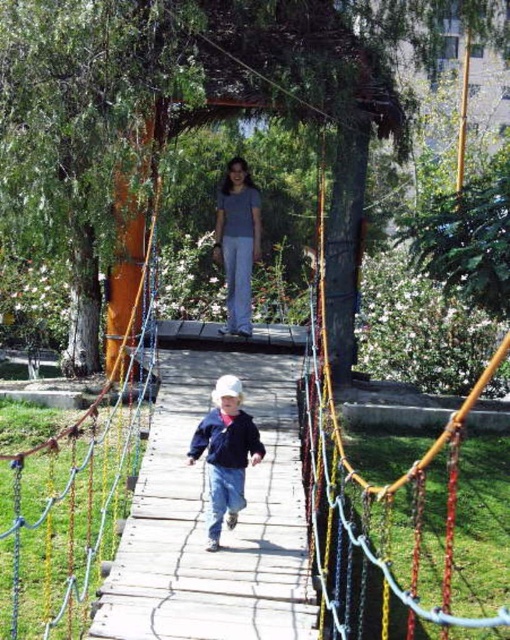
You are designing a safety plan for the suspension bridge and need to ensure that both the denim jacket at center and the matte gray shirt at center can walk side by side without touching each other. What is the minimum width the bridge must have?

The denim jacket at center has a larger width than the matte gray shirt at center. To ensure they can walk side by side without touching, the bridge must be at least the sum of both their widths plus a safe distance between them. However, since the exact widths aren not provided, the minimum width should be determined based on the widest individual, the denim jacket at center, plus a comfortable space for the other person.

You are standing on the wooden suspension bridge and want to reach the point at coordinates point [210,525]. If your walking speed is 3 feet per second, how many seconds will it take you to reach that point?

The distance of point [210,525] from viewer is 18.03 feet. At a speed of 3 feet per second, it will take 18.03 divided by 3, which is approximately 6.01 seconds to reach the point.